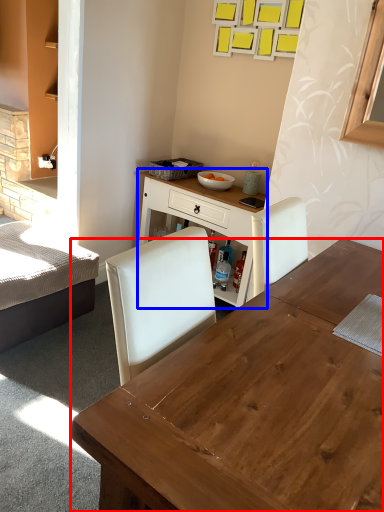
Question: Which object appears closest to the camera in this image, desk (highlighted by a red box) or table (highlighted by a blue box)?

Choices:
 (A) desk
 (B) table

Answer: (A)